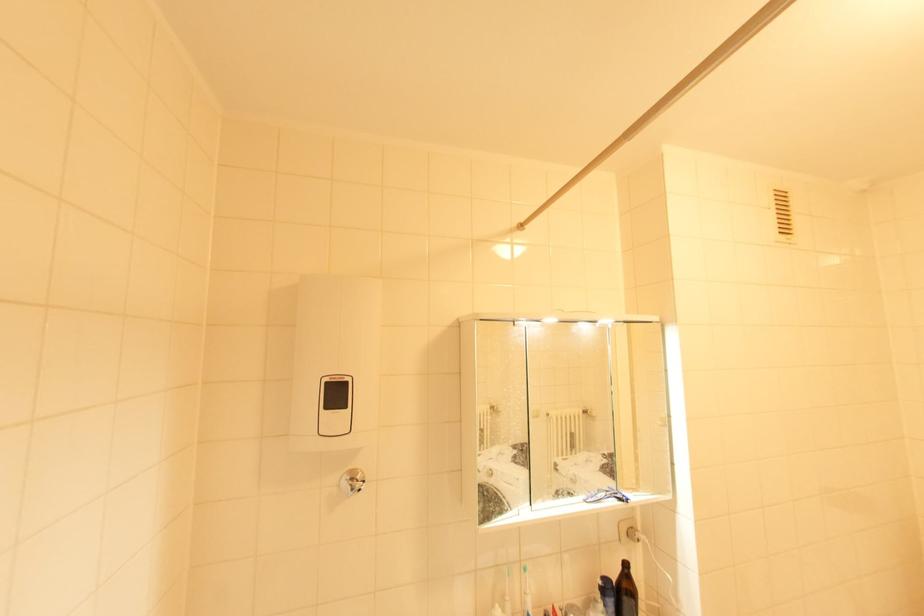
Which object does [526,592] point to?

It refers to a toothpaste tube.